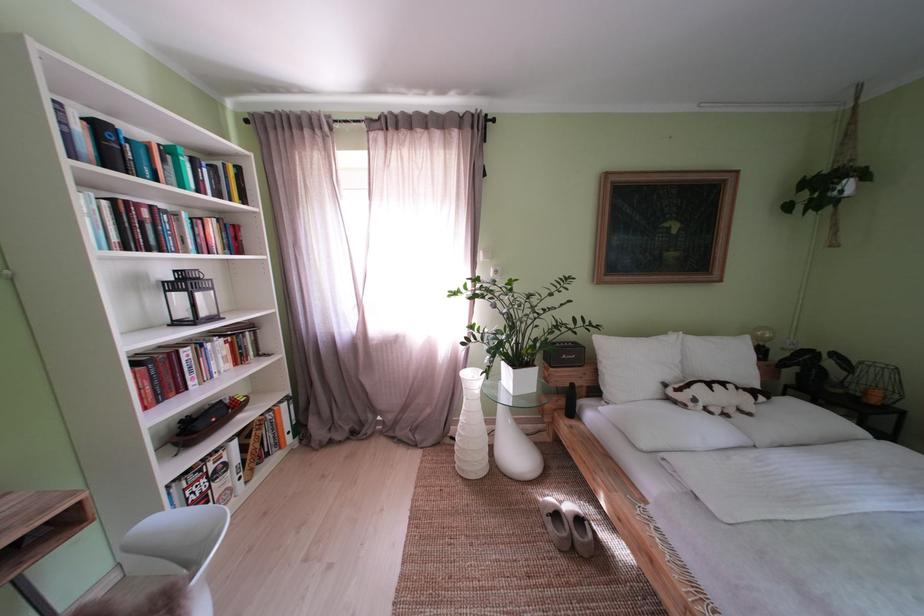
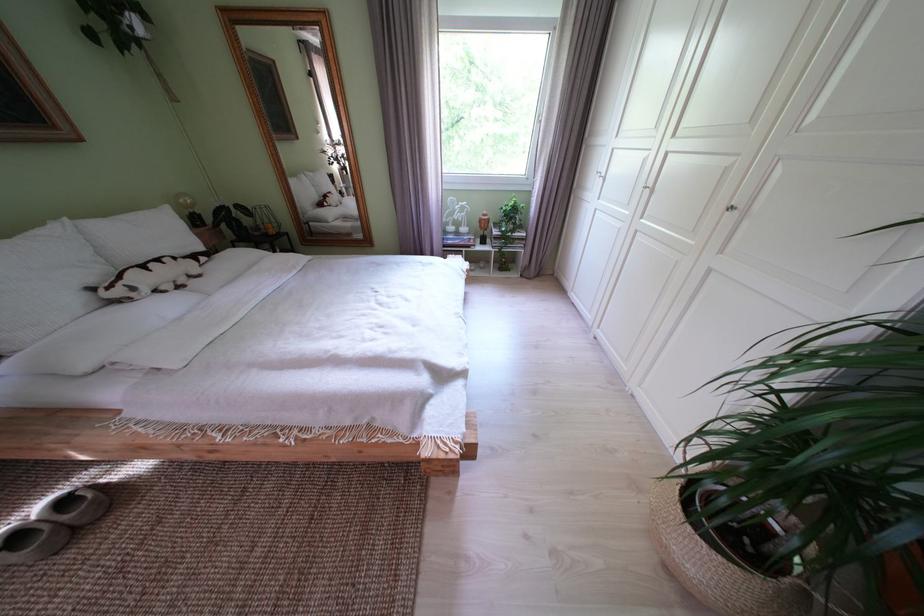
Locate, in the second image, the point that corresponds to point (706, 406) in the first image.

(146, 294)